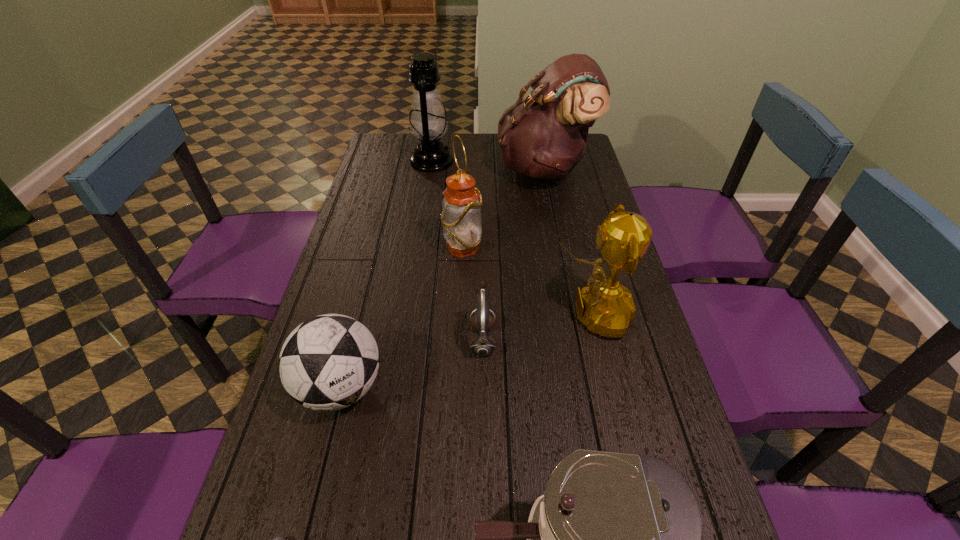
Image resolution: width=960 pixels, height=540 pixels. In order to click on free area in between the third farthest object and the earphone in this screenshot , I will do [x=472, y=293].

This screenshot has width=960, height=540. In order to click on blank region between the third shortest object and the second shortest object in this screenshot , I will do `click(412, 363)`.

Choose which object is the second nearest neighbor to the satchel. Please provide its 2D coordinates. Your answer should be formatted as a tuple, i.e. [(x, y)], where the tuple contains the x and y coordinates of a point satisfying the conditions above.

[(461, 207)]

Locate an element on the screen. Image resolution: width=960 pixels, height=540 pixels. the second closest object to the fourth shortest object is located at coordinates (329, 362).

Where is `free spot that satisfies the following two spatial constraints: 1. on the front side of the third farthest object; 2. on the right side of the farther oil lamp`? This screenshot has width=960, height=540. free spot that satisfies the following two spatial constraints: 1. on the front side of the third farthest object; 2. on the right side of the farther oil lamp is located at coordinates [x=419, y=248].